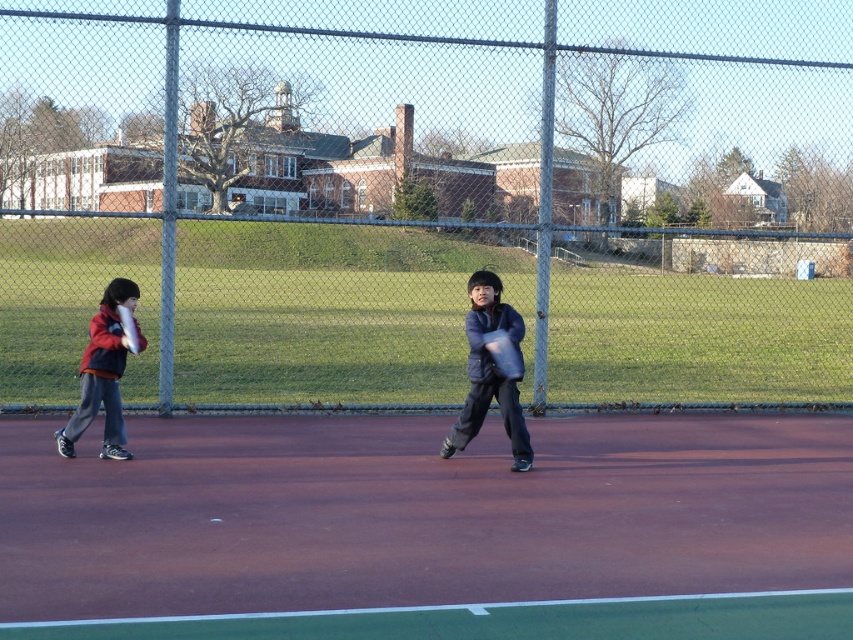
Does metal chain-link fence at center have a smaller size compared to smooth clay tennis court at center?

No.

Measure the distance from metal chain-link fence at center to smooth clay tennis court at center.

They are 16.51 meters apart.

Between point (786, 209) and point (416, 467), which one is positioned behind?

The point (786, 209) is behind.

You are a GUI agent. You are given a task and a screenshot of the screen. Output one action in this format:
    pyautogui.click(x=<x>, y=<y>)
    Task: Click on the metal chain-link fence at center
    
    Given the screenshot: What is the action you would take?
    pyautogui.click(x=428, y=196)

Locate an element on the screen. This screenshot has width=853, height=640. smooth clay tennis court at center is located at coordinates coord(431,529).

Which is below, red fleece jacket at left or translucent white racket at left?

red fleece jacket at left

Can you confirm if red fleece jacket at left is positioned below translucent white racket at left?

Indeed, red fleece jacket at left is positioned under translucent white racket at left.

The width and height of the screenshot is (853, 640). I want to click on red fleece jacket at left, so click(x=102, y=374).